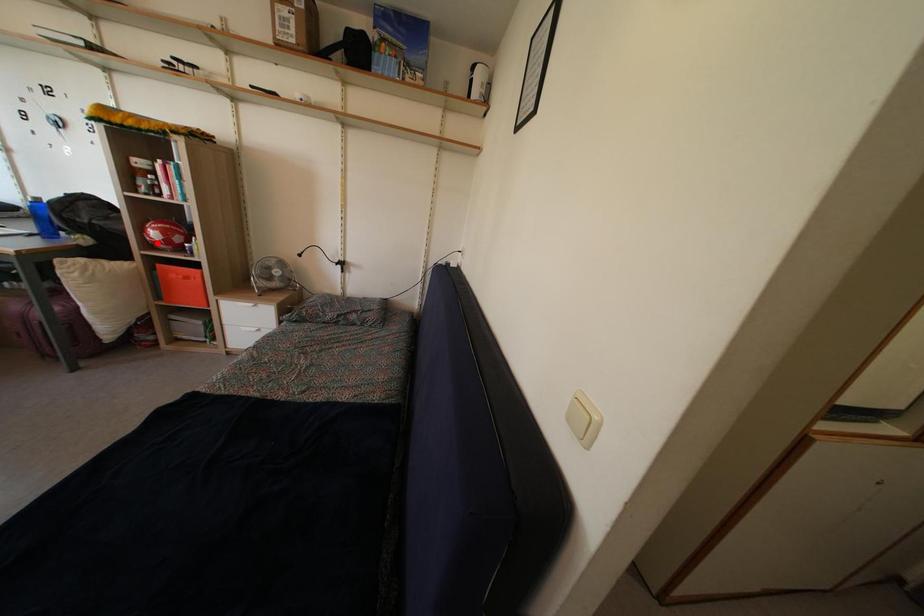
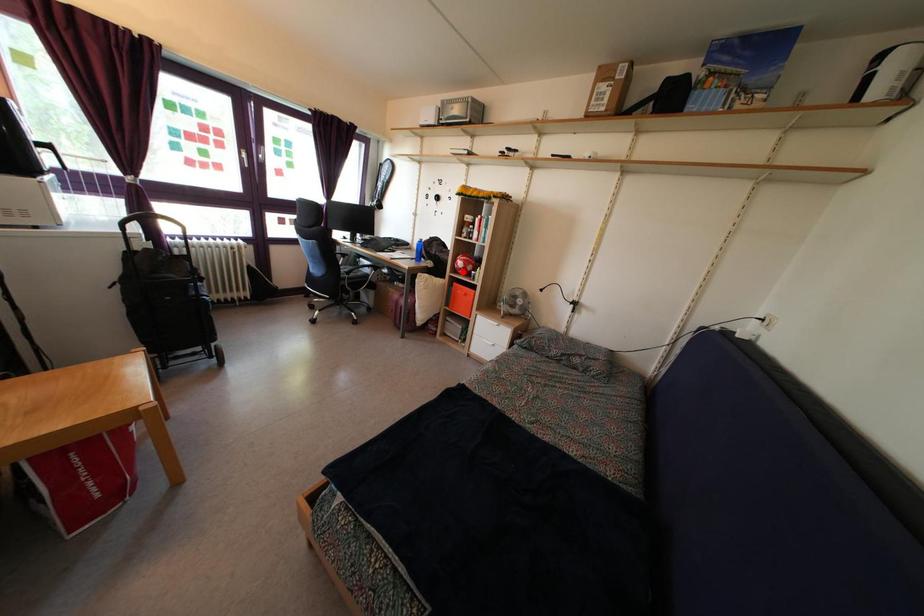
I am providing you with two images of the same scene from different viewpoints. A red point is marked on the first image and another point is marked on the second image. Does the point marked in image1 correspond to the same location as the one in image2?

Yes